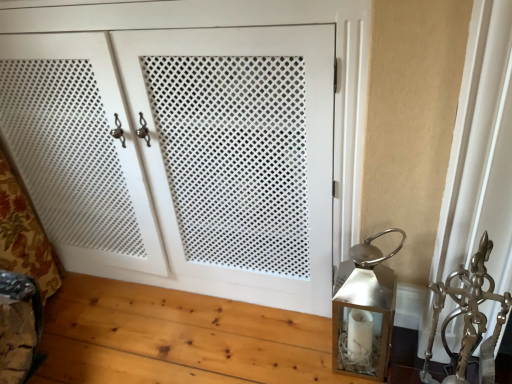
What do you see at coordinates (468, 318) in the screenshot? The image size is (512, 384). I see `metallic silver sculpture at right` at bounding box center [468, 318].

Locate an element on the screen. silver metallic lantern at right is located at coordinates (364, 309).

Which object is wider, white matte cabinet doors at center or metallic silver sculpture at right?

white matte cabinet doors at center.

Is white matte cabinet doors at center spatially inside metallic silver sculpture at right, or outside of it?

white matte cabinet doors at center is spatially situated outside metallic silver sculpture at right.

What's the angular difference between white matte cabinet doors at center and metallic silver sculpture at right's facing directions?

The angle between the facing direction of white matte cabinet doors at center and the facing direction of metallic silver sculpture at right is 0.475 degrees.

Is white matte cabinet doors at center at the right side of metallic silver sculpture at right?

No.

Where is `sculpture in front of the white matte cabinet doors at center`? The image size is (512, 384). sculpture in front of the white matte cabinet doors at center is located at coordinates (468, 318).

In terms of size, does metallic silver sculpture at right appear bigger or smaller than white matte cabinet doors at center?

In the image, metallic silver sculpture at right appears to be smaller than white matte cabinet doors at center.

Does metallic silver sculpture at right turn towards white matte cabinet doors at center?

No, metallic silver sculpture at right is not facing towards white matte cabinet doors at center.

Is silver metallic lantern at right facing away from white matte cabinet doors at center?

No.

Is silver metallic lantern at right taller or shorter than white matte cabinet doors at center?

silver metallic lantern at right is shorter than white matte cabinet doors at center.

Where is `table lamp below the white matte cabinet doors at center (from the image's perspective)`? table lamp below the white matte cabinet doors at center (from the image's perspective) is located at coordinates (364, 309).

Is the position of silver metallic lantern at right more distant than that of white matte cabinet doors at center?

Yes, the depth of silver metallic lantern at right is greater than that of white matte cabinet doors at center.

From a real-world perspective, is metallic silver sculpture at right over silver metallic lantern at right?

Yes.

Which object is further away from the camera, metallic silver sculpture at right or silver metallic lantern at right?

Positioned behind is silver metallic lantern at right.

Which of these two, metallic silver sculpture at right or silver metallic lantern at right, stands shorter?

silver metallic lantern at right is shorter.

Which is behind, point (433, 291) or point (380, 276)?

The point (380, 276) is more distant.

Is white matte cabinet doors at center next to silver metallic lantern at right and touching it?

No, white matte cabinet doors at center is not with silver metallic lantern at right.

Considering the relative positions of white matte cabinet doors at center and silver metallic lantern at right in the image provided, is white matte cabinet doors at center to the left of silver metallic lantern at right from the viewer's perspective?

Indeed, white matte cabinet doors at center is positioned on the left side of silver metallic lantern at right.

Between white matte cabinet doors at center and silver metallic lantern at right, which one has more height?

white matte cabinet doors at center is taller.

From the image's perspective, which is below, white matte cabinet doors at center or silver metallic lantern at right?

silver metallic lantern at right is shown below in the image.

Are silver metallic lantern at right and metallic silver sculpture at right making contact?

There is a gap between silver metallic lantern at right and metallic silver sculpture at right.

Is silver metallic lantern at right oriented towards metallic silver sculpture at right?

No, silver metallic lantern at right does not turn towards metallic silver sculpture at right.

Considering the sizes of silver metallic lantern at right and metallic silver sculpture at right in the image, is silver metallic lantern at right taller or shorter than metallic silver sculpture at right?

silver metallic lantern at right is shorter than metallic silver sculpture at right.

Identify the location of sculpture that is below the white matte cabinet doors at center (from the image's perspective). (468, 318).

Find the location of `door above the metallic silver sculpture at right (from the image's perspective)`. door above the metallic silver sculpture at right (from the image's perspective) is located at coordinates (182, 155).

Considering their positions, is silver metallic lantern at right positioned further to metallic silver sculpture at right than white matte cabinet doors at center?

Among the two, white matte cabinet doors at center is located further to metallic silver sculpture at right.

Looking at the image, which one is located further to white matte cabinet doors at center, silver metallic lantern at right or metallic silver sculpture at right?

The object further to white matte cabinet doors at center is metallic silver sculpture at right.

From the image, which object appears to be nearer to silver metallic lantern at right, metallic silver sculpture at right or white matte cabinet doors at center?

Based on the image, metallic silver sculpture at right appears to be nearer to silver metallic lantern at right.

In the scene shown: Which object lies nearer to the anchor point metallic silver sculpture at right, white matte cabinet doors at center or silver metallic lantern at right?

Among the two, silver metallic lantern at right is located nearer to metallic silver sculpture at right.

From the image, which object appears to be nearer to white matte cabinet doors at center, metallic silver sculpture at right or silver metallic lantern at right?

Among the two, silver metallic lantern at right is located nearer to white matte cabinet doors at center.

From the image, which object appears to be nearer to silver metallic lantern at right, white matte cabinet doors at center or metallic silver sculpture at right?

The object closer to silver metallic lantern at right is metallic silver sculpture at right.

The width and height of the screenshot is (512, 384). In order to click on table lamp between white matte cabinet doors at center and metallic silver sculpture at right in this screenshot , I will do `click(364, 309)`.